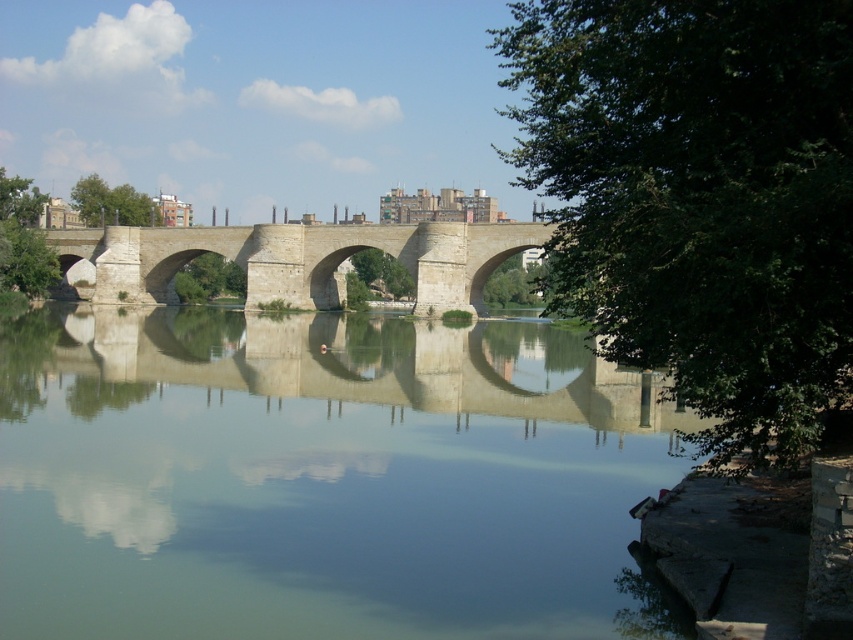
You are standing on the stone bridge and want to take a photo of the greenish water at center. Where should you aim your camera to capture it?

The greenish water at center is located at point [322,477], so aim your camera towards that coordinate to capture it.